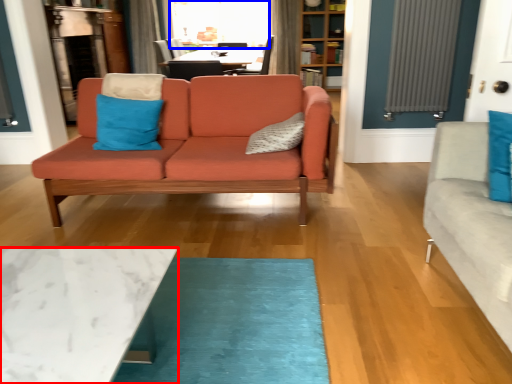
Question: Which of the following is the farthest to the observer, coffee table (highlighted by a red box) or window screen (highlighted by a blue box)?

Choices:
 (A) coffee table
 (B) window screen

Answer: (B)